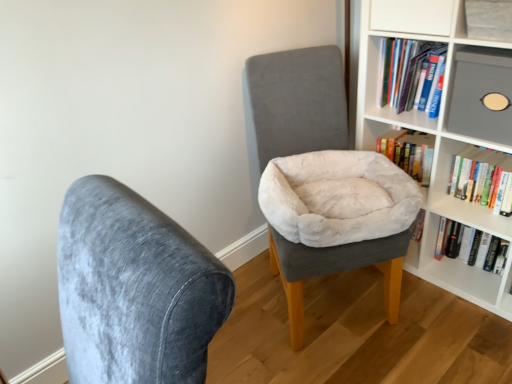
At what (x,y) coordinates should I click in order to perform the action: click on vacant area that is in front of velvet gray chair at center, the second chair in the front-to-back sequence. Please return your answer as a coordinate pair (x, y). Image resolution: width=512 pixels, height=384 pixels. Looking at the image, I should click on (361, 363).